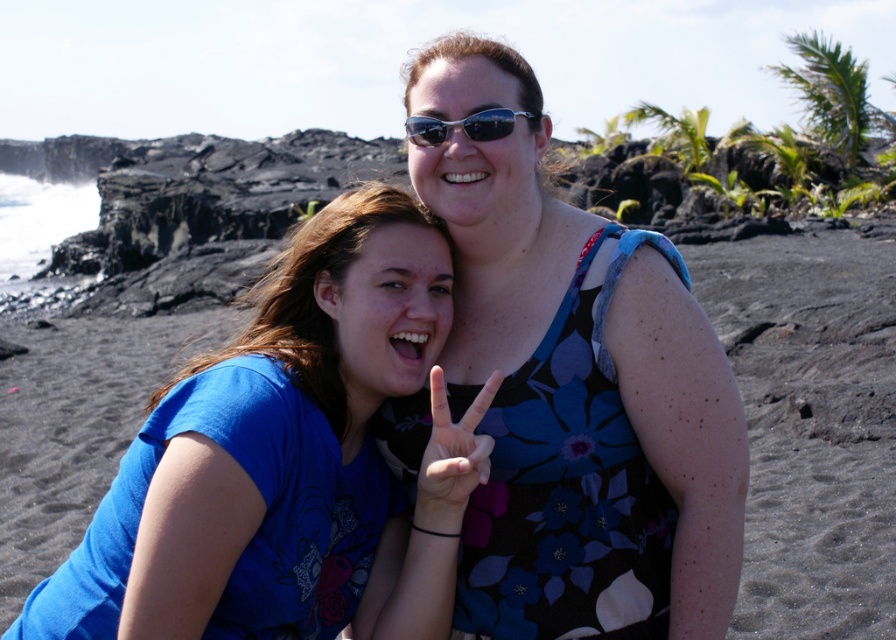
You are a photographer trying to capture a balanced composition. Given the two subjects, the floral dress at center and the blue cotton shirt at center, which one should you focus on to ensure the subject appears taller in the photo?

The floral dress at center is much taller than the blue cotton shirt at center, so focusing on the floral dress at center will ensure the subject appears taller in the photo.

You are standing at the origin point of the coordinate system in the image. You want to walk to the point labeled point (188, 410) and then to point (403, 124). Which direction should you head first to reach both points in order?

You should first head towards point (188, 410) since it is in front of point (403, 124), so you can reach it first before moving to the latter point.